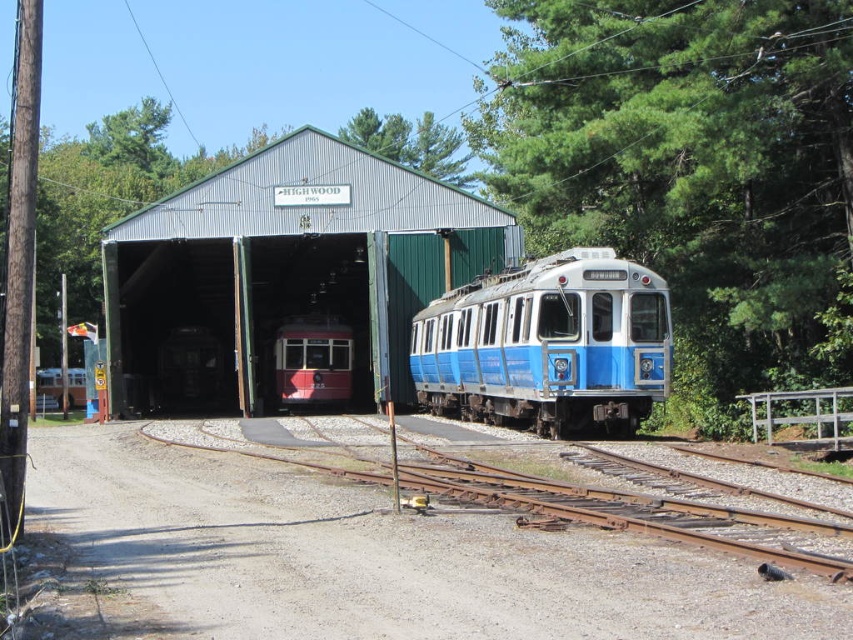
Measure the distance between green corrugated metal train shed at center and matte red train at center.

They are 4.69 meters apart.

Who is more forward, (134,292) or (311,348)?

Positioned in front is point (311,348).

Is point (219, 300) positioned before point (351, 348)?

No, (219, 300) is further to viewer.

Where is `green corrugated metal train shed at center`? The height and width of the screenshot is (640, 853). green corrugated metal train shed at center is located at coordinates (285, 275).

Which is above, green corrugated metal train shed at center or blue polished metal train at center?

Positioned higher is green corrugated metal train shed at center.

Is green corrugated metal train shed at center shorter than blue polished metal train at center?

No, green corrugated metal train shed at center is not shorter than blue polished metal train at center.

Is point (259, 192) positioned behind point (450, 372)?

Yes, it is.

At what (x,y) coordinates should I click in order to perform the action: click on green corrugated metal train shed at center. Please return your answer as a coordinate pair (x, y). Looking at the image, I should click on (285, 275).

Image resolution: width=853 pixels, height=640 pixels. Describe the element at coordinates (381, 557) in the screenshot. I see `dirt gravel at lower center` at that location.

Image resolution: width=853 pixels, height=640 pixels. I want to click on dirt gravel at lower center, so click(x=381, y=557).